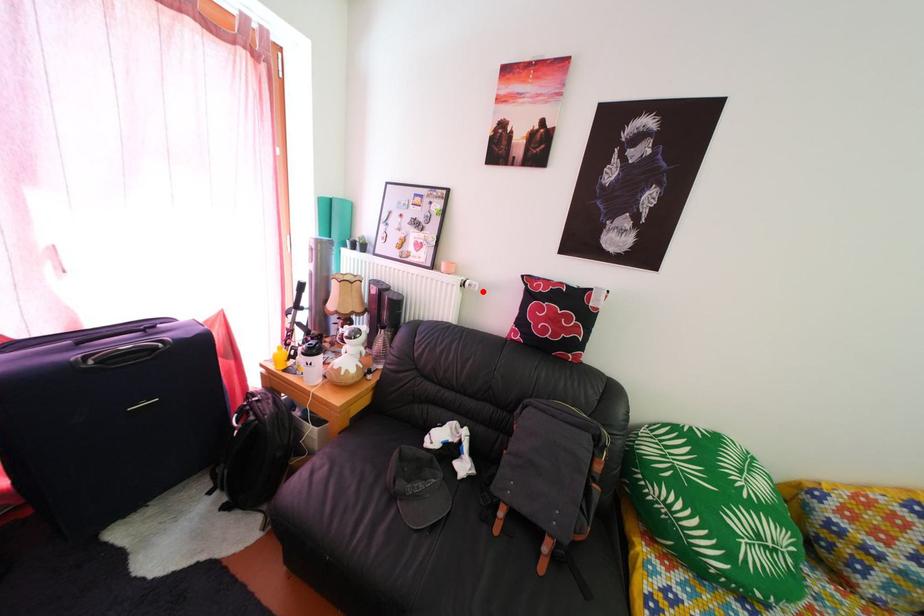
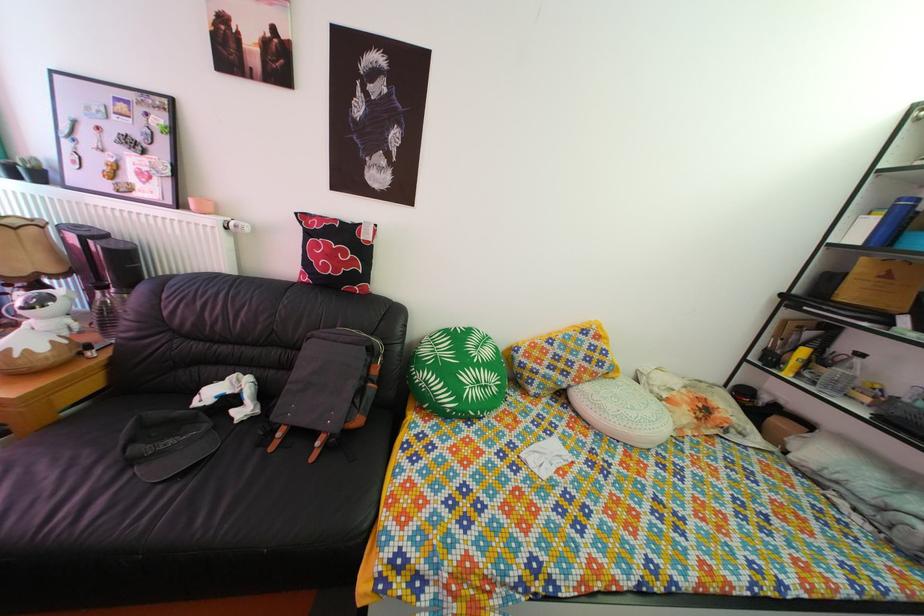
Locate, in the second image, the point that corresponds to the highlighted location in the first image.

(249, 232)